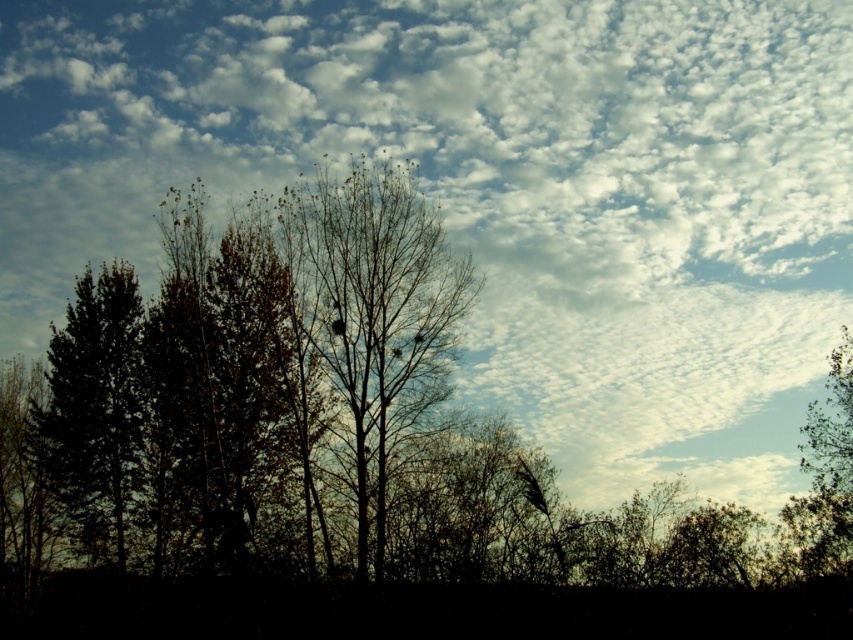
Which of these two, dark green leafy tree at left or green leafy tree at right, stands taller?

dark green leafy tree at left is taller.

Between point (114, 492) and point (848, 346), which one is positioned behind?

The point (114, 492) is behind.

This screenshot has width=853, height=640. I want to click on dark green leafy tree at left, so click(97, 410).

Can you confirm if bare branches at center is positioned to the left of green leafy tree at right?

Correct, you'll find bare branches at center to the left of green leafy tree at right.

Is bare branches at center thinner than green leafy tree at right?

No.

Locate an element on the screen. Image resolution: width=853 pixels, height=640 pixels. bare branches at center is located at coordinates (370, 324).

Locate an element on the screen. bare branches at center is located at coordinates click(370, 324).

Is bare branches at center behind dark green leafy tree at left?

No, it is in front of dark green leafy tree at left.

Can you confirm if bare branches at center is positioned above dark green leafy tree at left?

Indeed, bare branches at center is positioned over dark green leafy tree at left.

This screenshot has height=640, width=853. What do you see at coordinates (370, 324) in the screenshot?
I see `bare branches at center` at bounding box center [370, 324].

Where is `bare branches at center`? bare branches at center is located at coordinates (370, 324).